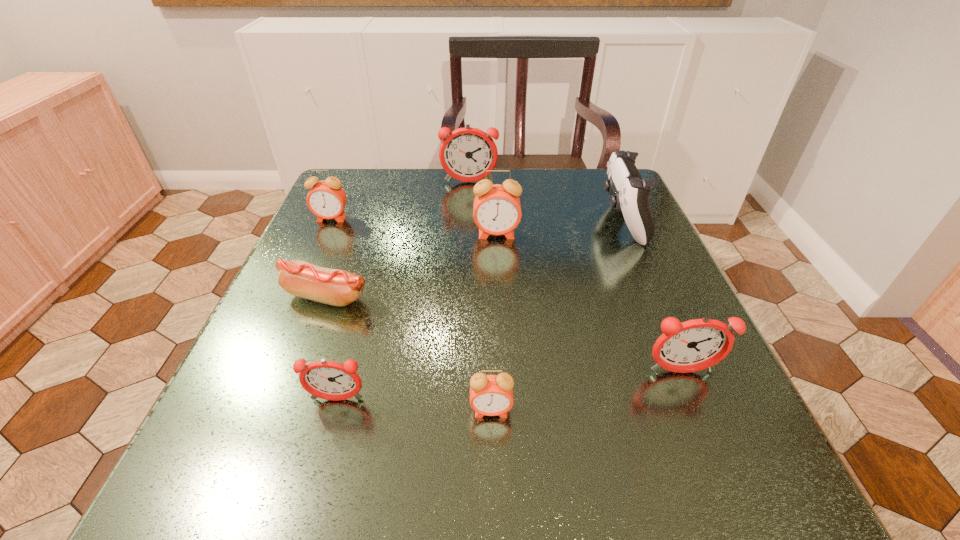
Locate an element on the screen. vacant space at the far edge is located at coordinates (516, 168).

Identify the location of vacant space at the left edge. (288, 348).

Identify the location of vacant space at the right edge of the desktop. (629, 247).

Image resolution: width=960 pixels, height=540 pixels. In the image, there is a desktop. Find the location of `free space at the far left corner`. free space at the far left corner is located at coordinates (379, 215).

Find the location of `blank space at the near left corner`. blank space at the near left corner is located at coordinates (300, 443).

Where is `free space at the far right corner`? free space at the far right corner is located at coordinates (604, 173).

This screenshot has width=960, height=540. I want to click on free space at the near right corner, so click(693, 482).

Locate an element on the screen. free spot between the smallest pink alarm clock and the third nearest alarm clock is located at coordinates (587, 392).

At what (x,y) coordinates should I click in order to perform the action: click on free space between the sixth farthest object and the smallest pink alarm clock. Please return your answer as a coordinate pair (x, y). Looking at the image, I should click on 587,392.

Identify the location of vacant area that lies between the second alarm clock from left to right and the sausage. point(332,348).